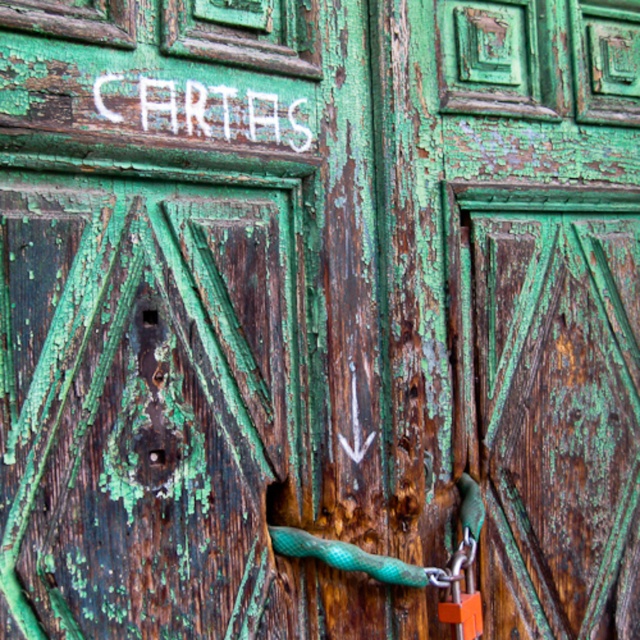
You are standing 1.23 meters away from the point at coordinates (140, 88) on the door. If you want to see the faded arrow pointing downward below the word CARTES, which direction should you move relative to your current position?

Since the point at coordinates (140, 88) is 1.23 meters away from you, and the faded arrow is below the word CARTES, you should move downward to see the arrow.

You are a painter who needs to touch up the white painted letters at upper center and the orange metallic padlock at lower right. Which object requires more vertical space to work on?

The orange metallic padlock at lower right requires more vertical space to work on because it is taller than the white painted letters at upper center.

You are a painter preparing to paint the green weathered wood door at center and the orange metallic padlock at lower right. Which object requires a larger amount of paint due to its size?

The green weathered wood door at center requires a larger amount of paint because it has a greater height compared to the orange metallic padlock at lower right.